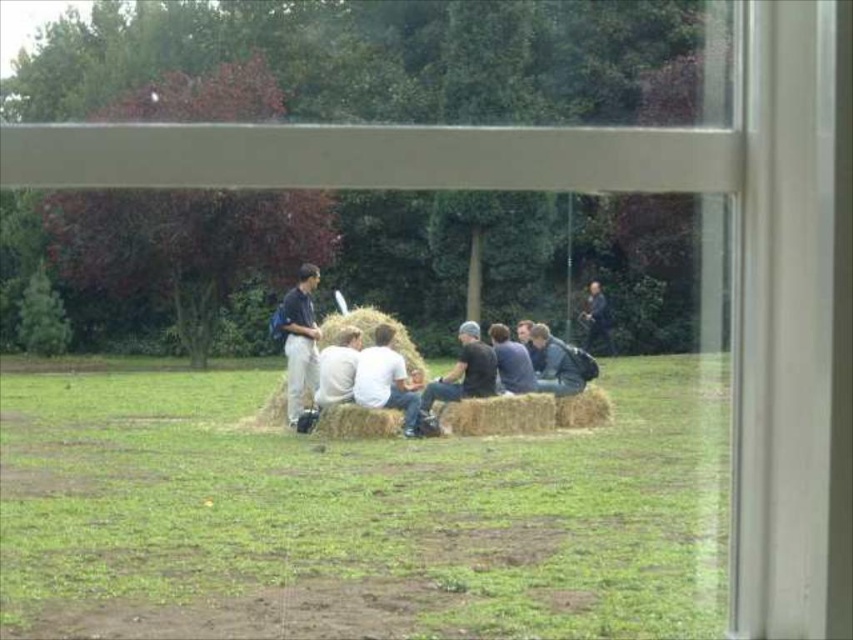
You are a photographer trying to capture a clear shot of the dark blue leather jacket at center without the light brown straw bale at center blocking it. How should you adjust your position?

The light brown straw bale at center is positioned over the dark blue leather jacket at center, so you should move your camera position lower to avoid the straw bale blocking the jacket.

You are standing in the park and see the light brown straw bale at center and the dark blue leather jacket at center. Which object is positioned more to the left side?

The light brown straw bale at center is positioned more to the left side than the dark blue leather jacket at center.